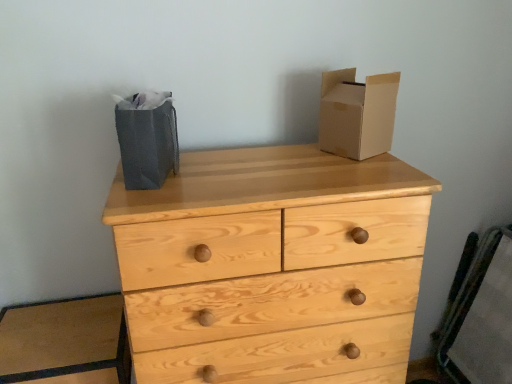
Question: Can you confirm if natural wood chest of drawers at center is taller than gray paper bag at left?

Choices:
 (A) no
 (B) yes

Answer: (B)

Question: From the image's perspective, is natural wood chest of drawers at center below gray paper bag at left?

Choices:
 (A) yes
 (B) no

Answer: (A)

Question: Is natural wood chest of drawers at center smaller than gray paper bag at left?

Choices:
 (A) yes
 (B) no

Answer: (B)

Question: Considering the relative sizes of natural wood chest of drawers at center and gray paper bag at left in the image provided, is natural wood chest of drawers at center thinner than gray paper bag at left?

Choices:
 (A) no
 (B) yes

Answer: (A)

Question: Is gray paper bag at left inside natural wood chest of drawers at center?

Choices:
 (A) yes
 (B) no

Answer: (B)

Question: Considering the positions of gray paper bag at left and cardboard box at upper right in the image, is gray paper bag at left wider or thinner than cardboard box at upper right?

Choices:
 (A) wide
 (B) thin

Answer: (A)

Question: Based on their positions, is gray paper bag at left located to the left or right of cardboard box at upper right?

Choices:
 (A) right
 (B) left

Answer: (B)

Question: Choose the correct answer: Is gray paper bag at left inside cardboard box at upper right or outside it?

Choices:
 (A) outside
 (B) inside

Answer: (A)

Question: In terms of height, does gray paper bag at left look taller or shorter compared to cardboard box at upper right?

Choices:
 (A) short
 (B) tall

Answer: (A)

Question: Considering the positions of wooden chair at right and cardboard box at upper right in the image, is wooden chair at right taller or shorter than cardboard box at upper right?

Choices:
 (A) tall
 (B) short

Answer: (A)

Question: Is wooden chair at right in front of or behind cardboard box at upper right in the image?

Choices:
 (A) behind
 (B) front

Answer: (A)

Question: Is wooden chair at right wider or thinner than cardboard box at upper right?

Choices:
 (A) thin
 (B) wide

Answer: (A)

Question: Do you think wooden chair at right is within cardboard box at upper right, or outside of it?

Choices:
 (A) inside
 (B) outside

Answer: (B)

Question: From the image's perspective, is cardboard box at upper right above or below gray paper bag at left?

Choices:
 (A) below
 (B) above

Answer: (B)

Question: Would you say cardboard box at upper right is to the left or to the right of gray paper bag at left in the picture?

Choices:
 (A) left
 (B) right

Answer: (B)